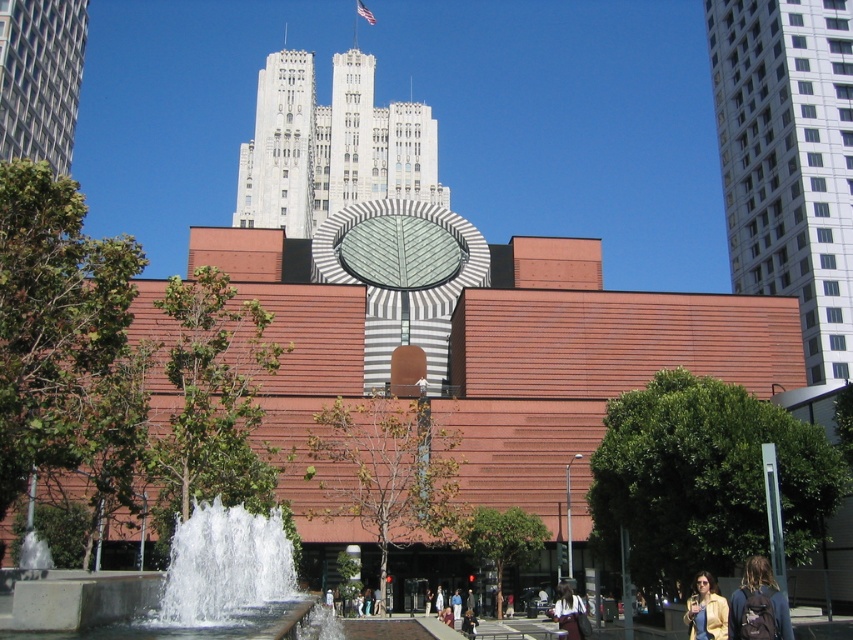
Question: Which of the following is the farthest from the observer?

Choices:
 (A) dark brown leather jacket at lower center
 (B) yellow matte jacket at lower right
 (C) white stone tower at upper center

Answer: (C)

Question: Which of the following is the farthest from the observer?

Choices:
 (A) (579, 636)
 (B) (233, 509)
 (C) (689, 602)

Answer: (A)

Question: Does clear glass water at center appear under metallic glass skyscraper at upper left?

Choices:
 (A) yes
 (B) no

Answer: (A)

Question: Can you confirm if dark brown backpack at lower right is wider than yellow matte jacket at lower right?

Choices:
 (A) yes
 (B) no

Answer: (A)

Question: Does white stone tower at upper center appear on the left side of clear glass water at center?

Choices:
 (A) no
 (B) yes

Answer: (B)

Question: Which object is the closest to the dark brown leather jacket at lower center?

Choices:
 (A) clear glass water at center
 (B) white stone tower at upper center
 (C) dark brown backpack at lower right
 (D) yellow matte jacket at lower right

Answer: (D)